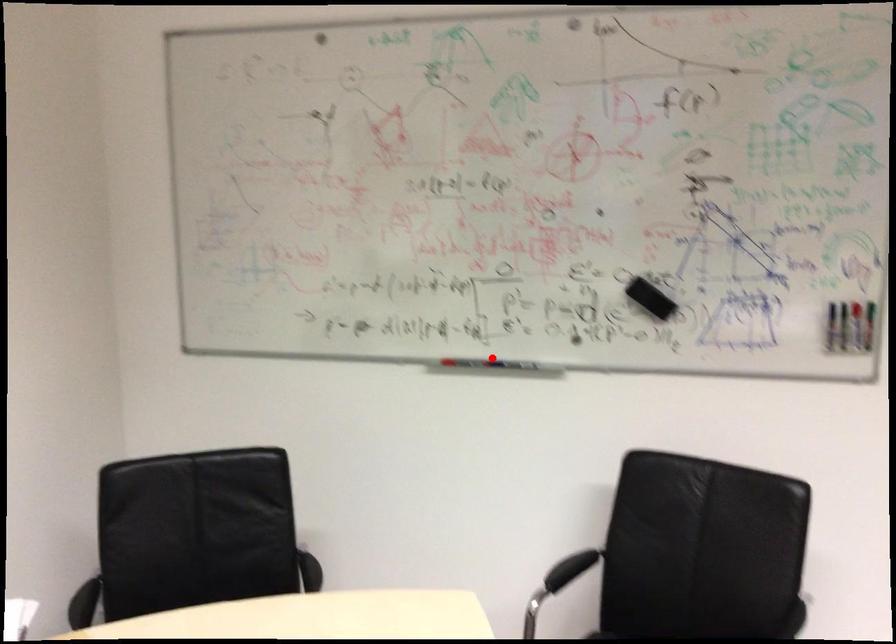
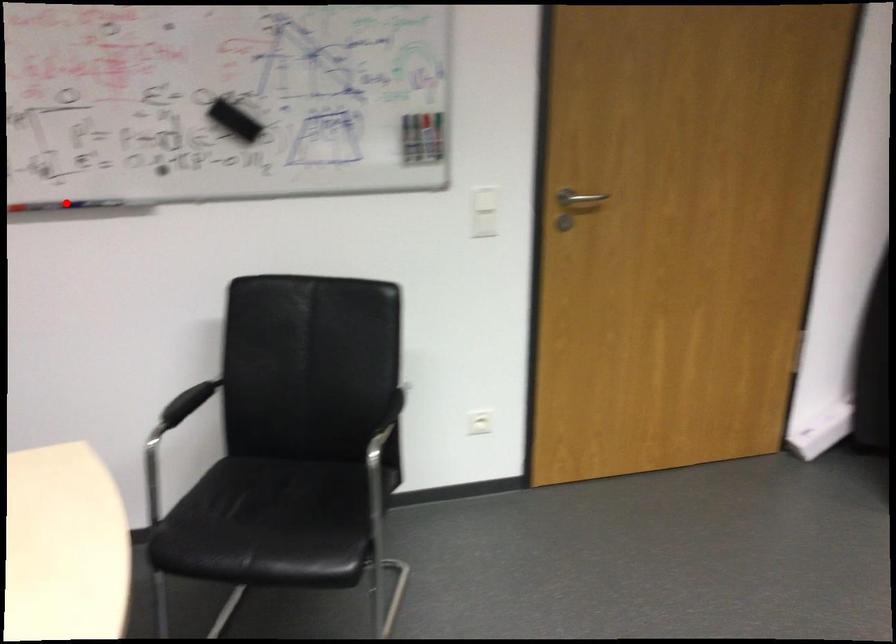
I am providing you with two images of the same scene from different viewpoints. A red point is marked on the first image and another point is marked on the second image. Are the points marked in image1 and image2 representing the same 3D position?

Yes